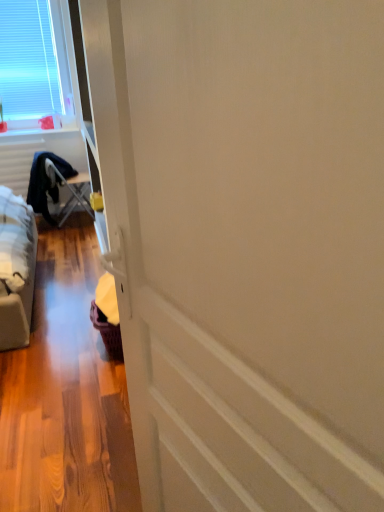
Question: Would you say white plastic window at upper left is inside or outside metallic silver folding table at left?

Choices:
 (A) inside
 (B) outside

Answer: (B)

Question: Considering the relative positions of white plastic window at upper left and metallic silver folding table at left in the image provided, is white plastic window at upper left to the left or to the right of metallic silver folding table at left?

Choices:
 (A) left
 (B) right

Answer: (A)

Question: Looking at their shapes, would you say white plastic window at upper left is wider or thinner than metallic silver folding table at left?

Choices:
 (A) thin
 (B) wide

Answer: (A)

Question: From a real-world perspective, is metallic silver folding table at left positioned above or below white plastic window at upper left?

Choices:
 (A) below
 (B) above

Answer: (A)

Question: Does point (59, 180) appear closer or farther from the camera than point (16, 37)?

Choices:
 (A) farther
 (B) closer

Answer: (A)

Question: Based on their positions, is metallic silver folding table at left located to the left or right of white plastic window at upper left?

Choices:
 (A) right
 (B) left

Answer: (A)

Question: Would you say metallic silver folding table at left is inside or outside white plastic window at upper left?

Choices:
 (A) inside
 (B) outside

Answer: (B)